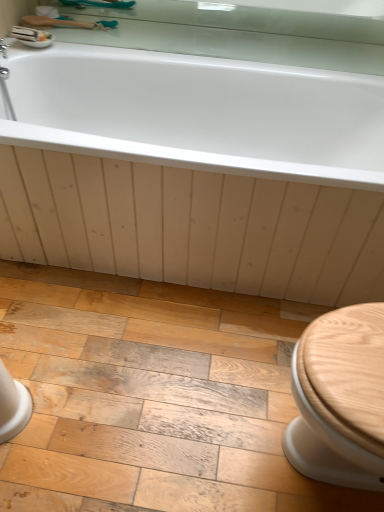
Question: Does wooden floor at lower center have a smaller size compared to white glossy sink at upper left?

Choices:
 (A) yes
 (B) no

Answer: (B)

Question: Is there a large distance between wooden floor at lower center and white glossy sink at upper left?

Choices:
 (A) yes
 (B) no

Answer: (A)

Question: Does wooden floor at lower center come behind white glossy sink at upper left?

Choices:
 (A) no
 (B) yes

Answer: (A)

Question: Does wooden floor at lower center appear on the right side of white glossy sink at upper left?

Choices:
 (A) no
 (B) yes

Answer: (B)

Question: Is wooden floor at lower center closer to the viewer compared to white glossy sink at upper left?

Choices:
 (A) yes
 (B) no

Answer: (A)

Question: Considering the relative positions of white glossy bathtub at upper center and clear glass mirror at upper center in the image provided, is white glossy bathtub at upper center to the left or to the right of clear glass mirror at upper center?

Choices:
 (A) right
 (B) left

Answer: (B)

Question: Based on their sizes in the image, would you say white glossy bathtub at upper center is bigger or smaller than clear glass mirror at upper center?

Choices:
 (A) big
 (B) small

Answer: (A)

Question: From the image's perspective, is white glossy bathtub at upper center positioned above or below clear glass mirror at upper center?

Choices:
 (A) above
 (B) below

Answer: (B)

Question: Considering their positions, is white glossy bathtub at upper center located in front of or behind clear glass mirror at upper center?

Choices:
 (A) front
 (B) behind

Answer: (A)

Question: From the image's perspective, is white glossy bathtub at upper center positioned above or below white glossy sink at upper left?

Choices:
 (A) below
 (B) above

Answer: (A)

Question: Is white glossy bathtub at upper center spatially inside white glossy sink at upper left, or outside of it?

Choices:
 (A) inside
 (B) outside

Answer: (B)

Question: Is white glossy bathtub at upper center to the left or to the right of white glossy sink at upper left in the image?

Choices:
 (A) left
 (B) right

Answer: (B)

Question: Is point (334, 233) positioned closer to the camera than point (44, 35)?

Choices:
 (A) farther
 (B) closer

Answer: (B)

Question: Is clear glass mirror at upper center taller or shorter than white glossy sink at upper left?

Choices:
 (A) short
 (B) tall

Answer: (B)

Question: Looking at their shapes, would you say clear glass mirror at upper center is wider or thinner than white glossy sink at upper left?

Choices:
 (A) thin
 (B) wide

Answer: (A)